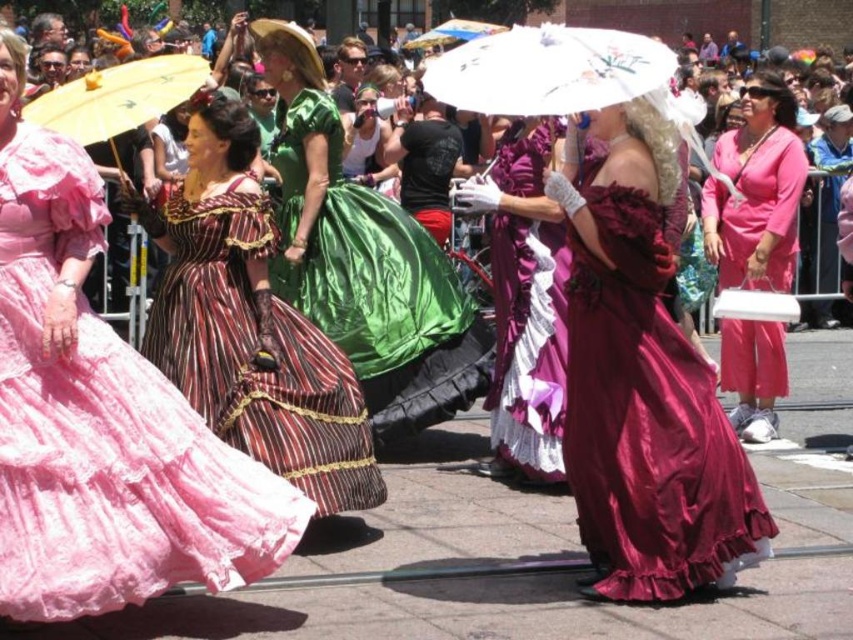
Who is higher up, purple satin dress at center or white paper umbrella at upper center?

Positioned higher is white paper umbrella at upper center.

Is purple satin dress at center thinner than white paper umbrella at upper center?

Yes.

What do you see at coordinates (526, 307) in the screenshot? I see `purple satin dress at center` at bounding box center [526, 307].

At what (x,y) coordinates should I click in order to perform the action: click on purple satin dress at center. Please return your answer as a coordinate pair (x, y). Looking at the image, I should click on (526, 307).

Between white paper umbrella at upper center and yellow paper parasol at upper left, which one is positioned lower?

yellow paper parasol at upper left

Can you confirm if white paper umbrella at upper center is bigger than yellow paper parasol at upper left?

Correct, white paper umbrella at upper center is larger in size than yellow paper parasol at upper left.

Which is behind, point (608, 36) or point (177, 92)?

Positioned behind is point (177, 92).

Find the location of `white paper umbrella at upper center`. white paper umbrella at upper center is located at coordinates (548, 70).

Who is higher up, pink satin dress at left or green satin dress at center?

green satin dress at center is higher up.

Can you confirm if pink satin dress at left is taller than green satin dress at center?

Incorrect, pink satin dress at left's height is not larger of green satin dress at center's.

Is point (57, 419) in front of point (460, 403)?

That is True.

You are a GUI agent. You are given a task and a screenshot of the screen. Output one action in this format:
    pyautogui.click(x=<x>, y=<y>)
    Task: Click on the pink satin dress at left
    This screenshot has height=640, width=853.
    Given the screenshot: What is the action you would take?
    pyautogui.click(x=102, y=417)